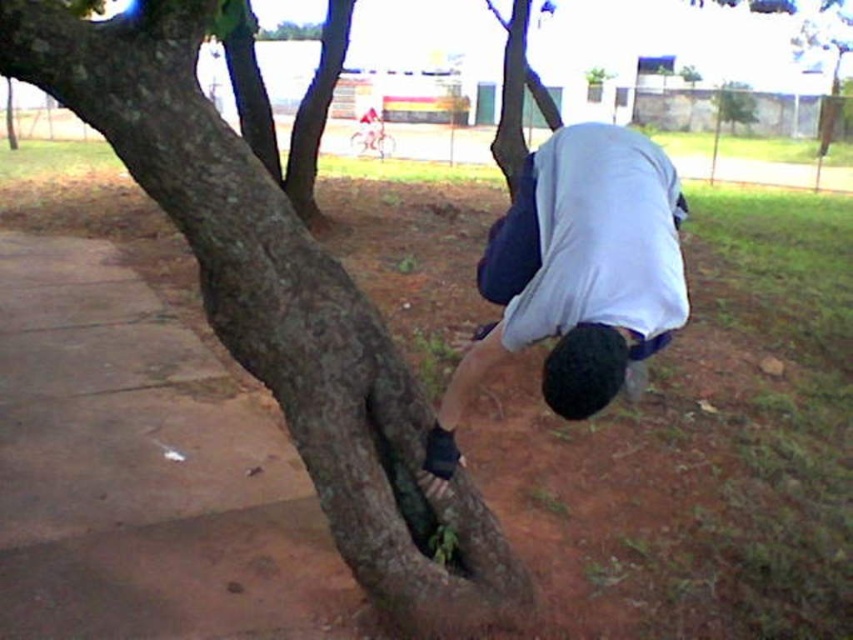
Question: Which of the following is the closest to the observer?

Choices:
 (A) (236, 20)
 (B) (526, 260)
 (C) (712, 100)

Answer: (B)

Question: Considering the real-world distances, which object is closest to the brown rough bark at center?

Choices:
 (A) brown rough tree trunk at center
 (B) green rough bark tree at upper center

Answer: (A)

Question: Which of these objects is positioned farthest from the brown rough bark at center?

Choices:
 (A) brown rough tree trunk at center
 (B) white matte shirt at center

Answer: (B)

Question: Considering the relative positions of white matte shirt at center and brown rough bark at center in the image provided, where is white matte shirt at center located with respect to brown rough bark at center?

Choices:
 (A) below
 (B) above

Answer: (A)

Question: Does brown rough tree trunk at center have a lesser width compared to white matte shirt at center?

Choices:
 (A) no
 (B) yes

Answer: (A)

Question: Does brown rough tree trunk at center have a greater width compared to brown rough bark at center?

Choices:
 (A) no
 (B) yes

Answer: (B)